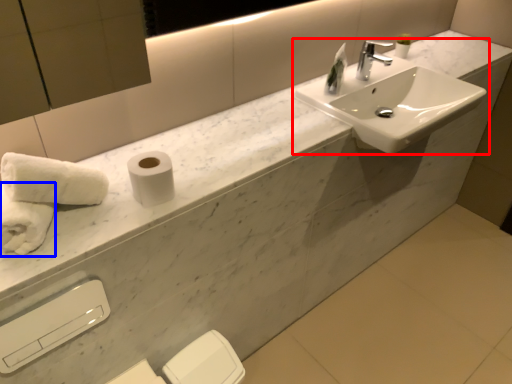
Question: Which object is further to the camera taking this photo, sink (highlighted by a red box) or bath towel (highlighted by a blue box)?

Choices:
 (A) sink
 (B) bath towel

Answer: (A)